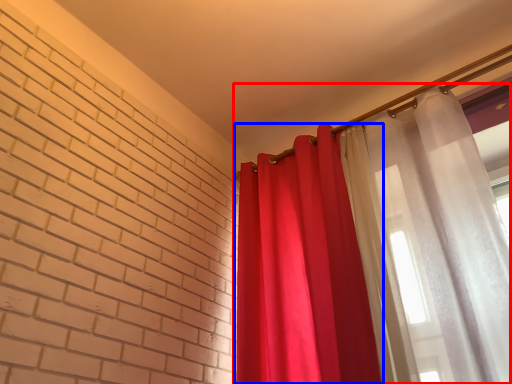
Question: Which object appears farthest to the camera in this image, curtain (highlighted by a red box) or curtain (highlighted by a blue box)?

Choices:
 (A) curtain
 (B) curtain

Answer: (B)